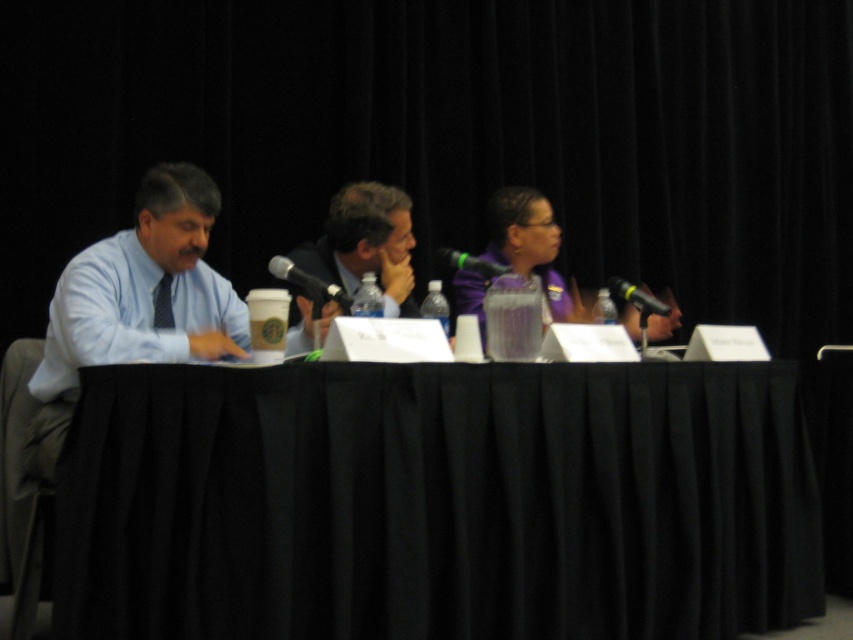
You are a sound technician adjusting the microphones for a panel discussion. You need to ensure that the microphones are spaced at least 20 inches apart to avoid feedback. Are the black plastic microphone at center and the green matte microphone at center spaced appropriately?

The black plastic microphone at center is 20.31 inches from green matte microphone at center, which meets the requirement of at least 20 inches, so they are spaced appropriately.

You are seated at the panel discussion table and need to locate two specific points on the table. The first point is at coordinates point (276, 256) and the second is at point (488, 266). Which of these points is closer to you from your seated position?

Point (276, 256) is behind point (488, 266), so the point closer to you would be point (488, 266) since it is in front.

You are a sound engineer setting up for a panel discussion. You need to ensure that both the black plastic microphone at center and the green matte microphone at center are positioned so they don not block the speakers. Given their potential width difference, which microphone should you adjust first to avoid blocking the speaker?

The black plastic microphone at center might be wider than the green matte microphone at center, so you should adjust the black plastic microphone at center first to avoid blocking the speaker.